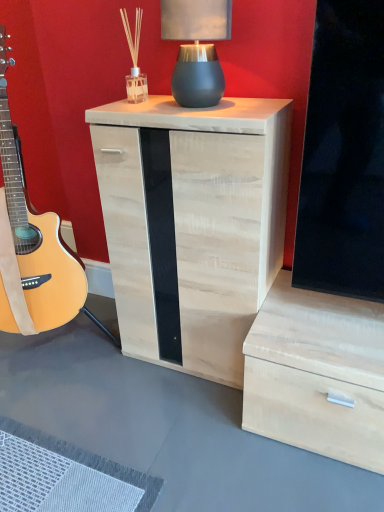
This screenshot has height=512, width=384. I want to click on free location in front of light wood/texture nightstand at center, so click(x=185, y=431).